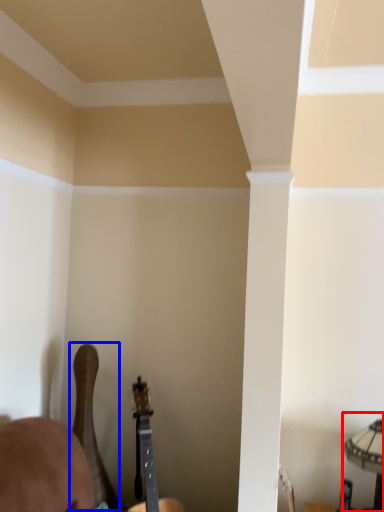
Question: Among these objects, which one is nearest to the camera, lamp (highlighted by a red box) or guitar (highlighted by a blue box)?

Choices:
 (A) lamp
 (B) guitar

Answer: (A)